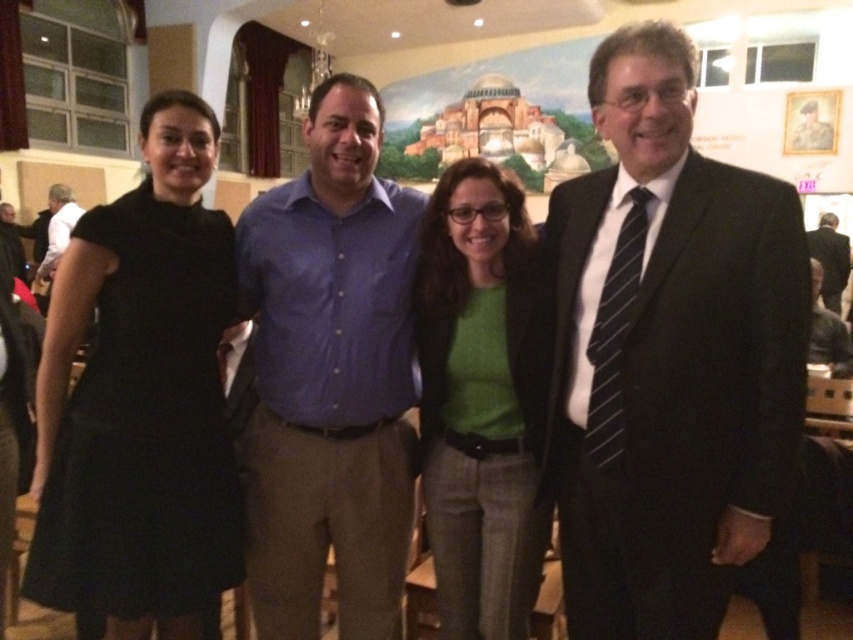
You are organizing a charity event and need to arrange two items on a shelf. You have the green matte shirt at center and the dark brown leather jacket at lower right. Which item should you place on the left side of the shelf to ensure they are arranged from thinnest to thickest?

The green matte shirt at center is thinner than the dark brown leather jacket at lower right, so you should place the green matte shirt at center on the left side of the shelf followed by the dark brown leather jacket at lower right to arrange them from thinnest to thickest.

You are standing in front of the group photo and notice two points marked in the image. The first point is at coordinates point (648, 337) and the second is at point (341, 620). Which of these two points is nearer to you?

Point (648, 337) is closer to the viewer than point (341, 620).